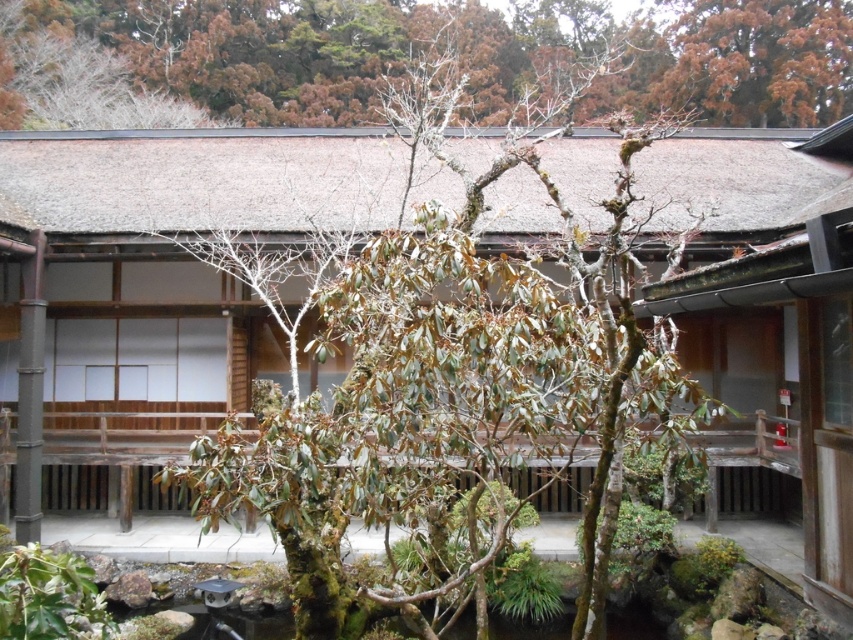
Question: Is green leafy tree at center above green leafy tree at upper center?

Choices:
 (A) yes
 (B) no

Answer: (B)

Question: Does green leafy tree at center appear on the right side of green leafy tree at upper center?

Choices:
 (A) yes
 (B) no

Answer: (A)

Question: Can you confirm if green leafy tree at center is positioned to the right of green leafy tree at upper center?

Choices:
 (A) yes
 (B) no

Answer: (A)